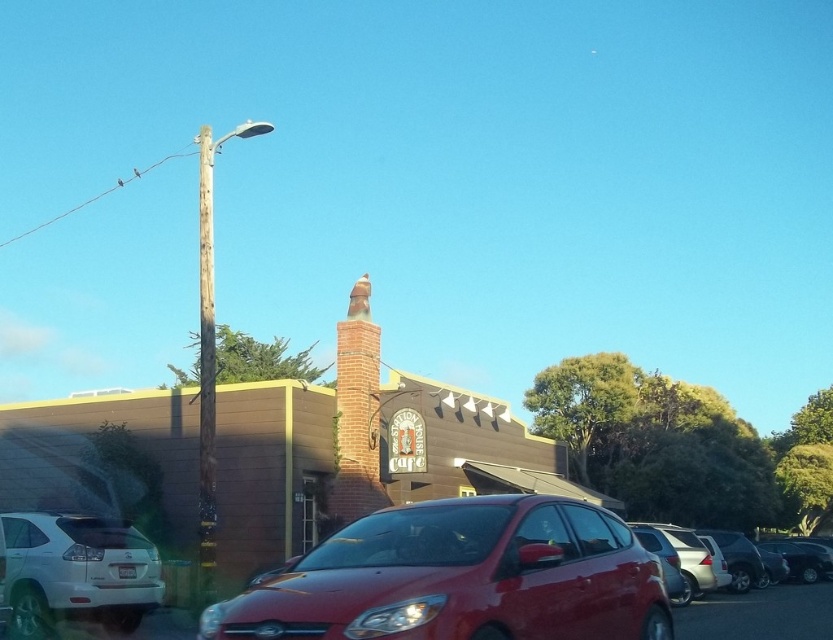
Looking at this image, you are a delivery person trying to park your truck next to the metallic silver car at lower right and the weathered wood pole at left. Which object is shorter so you can decide where to park?

The metallic silver car at lower right is not as tall as the weathered wood pole at left, so the metallic silver car at lower right is shorter. You should park next to the metallic silver car at lower right to ensure enough clearance.

You are a delivery person who needs to park your truck in the parking lot in front of the Station House Cafe. You see the glossy red sedan at center and the weathered wood pole at left. Which object is closer to the parking lot entrance?

The glossy red sedan at center is to the right of the weathered wood pole at left, so the weathered wood pole at left is closer to the parking lot entrance since it is positioned to the left of the sedan.

You are standing at the Station House Cafe and want to walk to the point labeled point (562, 634). Which direction should you go relative to point (20, 566)?

You should walk towards the front of point (20, 566) because point (562, 634) is located in front of it.